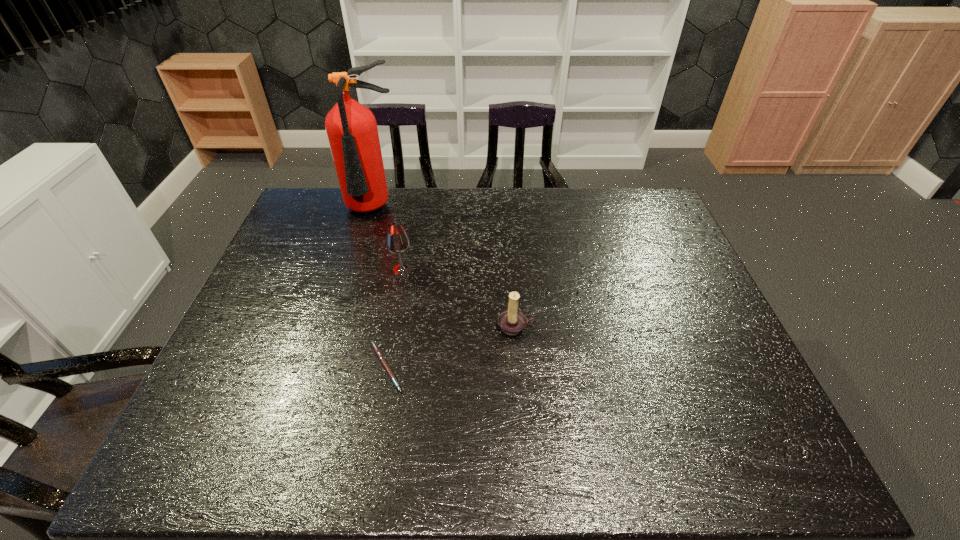
The width and height of the screenshot is (960, 540). In order to click on vacant area at the far right corner of the desktop in this screenshot , I will do `click(618, 188)`.

Identify the location of empty location between the nearest object and the wineglass. (394, 319).

In order to click on vacant point located between the farthest object and the nearest object in this screenshot , I will do `click(379, 289)`.

This screenshot has width=960, height=540. In order to click on free area in between the farthest object and the shortest object in this screenshot , I will do `click(379, 289)`.

Where is `vacant space in between the nearest object and the second farthest object`? vacant space in between the nearest object and the second farthest object is located at coordinates (394, 319).

At what (x,y) coordinates should I click in order to perform the action: click on free space between the fire extinguisher and the second shortest object. Please return your answer as a coordinate pair (x, y). Looking at the image, I should click on (444, 269).

Identify the location of free space between the farthest object and the third tallest object. (x=444, y=269).

Identify the location of free area in between the nearest object and the second farthest object. point(394,319).

At what (x,y) coordinates should I click in order to perform the action: click on free spot between the fire extinguisher and the rightmost object. Please return your answer as a coordinate pair (x, y). The width and height of the screenshot is (960, 540). Looking at the image, I should click on (444, 269).

At what (x,y) coordinates should I click in order to perform the action: click on the third closest object to the second shortest object. Please return your answer as a coordinate pair (x, y). This screenshot has height=540, width=960. Looking at the image, I should click on (351, 128).